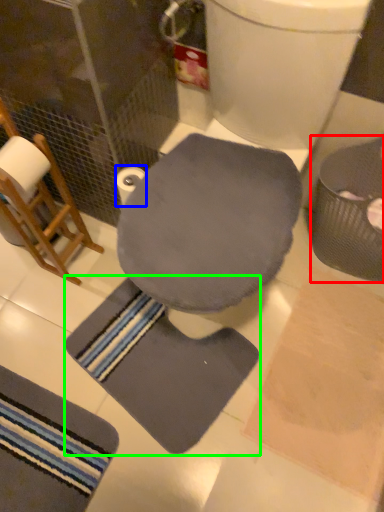
Question: Which is farther away from potty (highlighted by a red box)? toilet paper (highlighted by a blue box) or bath mat (highlighted by a green box)?

Choices:
 (A) toilet paper
 (B) bath mat

Answer: (A)